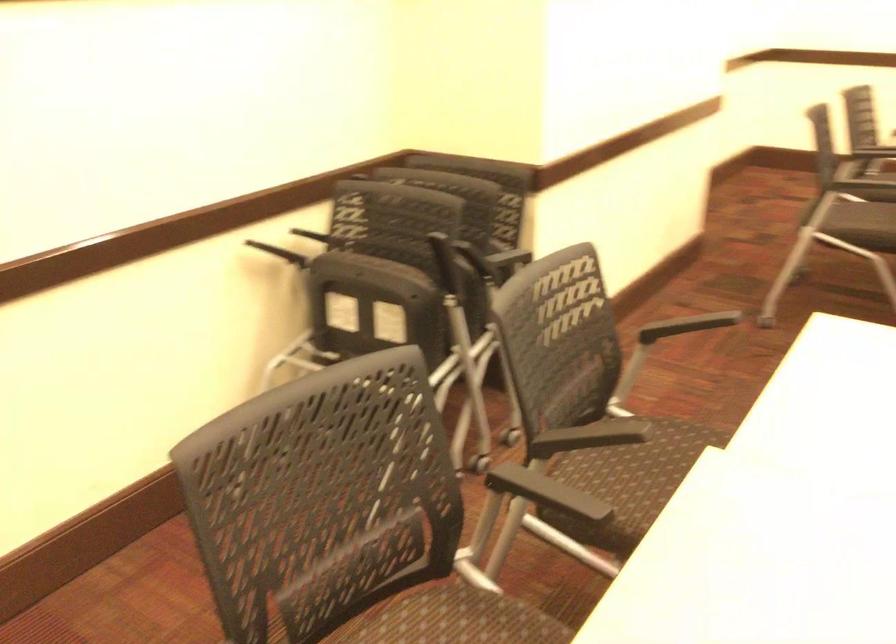
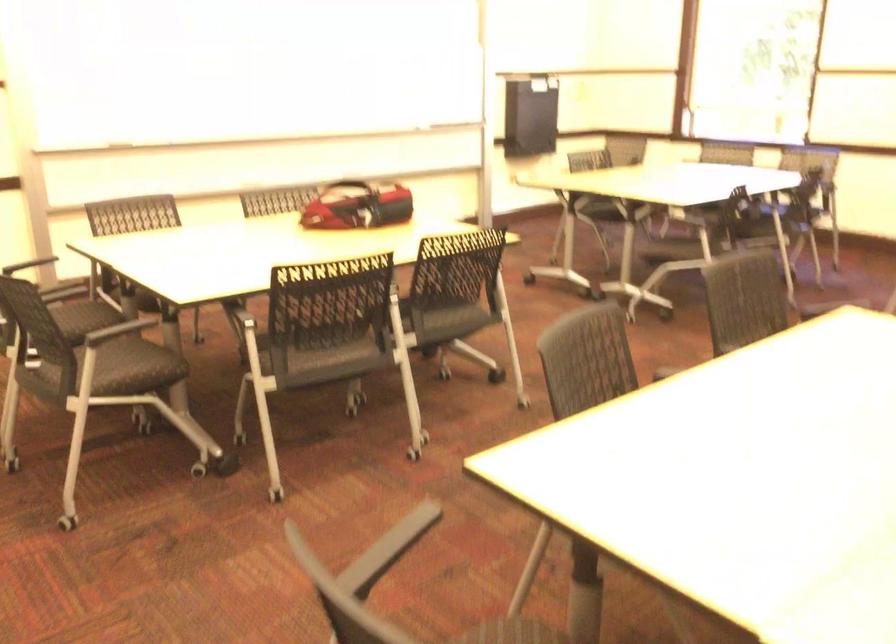
Find the pixel in the second image that matches point 694,319 in the first image.

(389, 549)